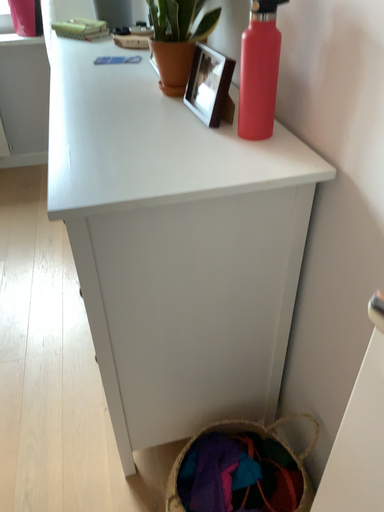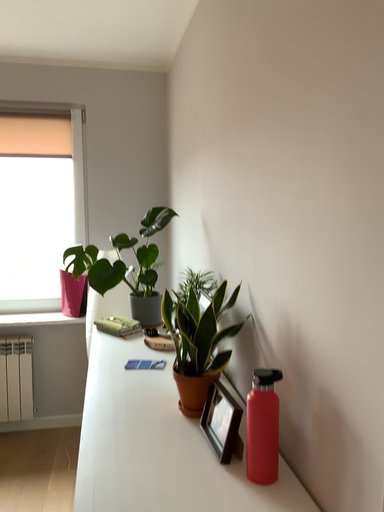
Question: How did the camera likely rotate when shooting the video?

Choices:
 (A) rotated upward
 (B) rotated downward

Answer: (A)